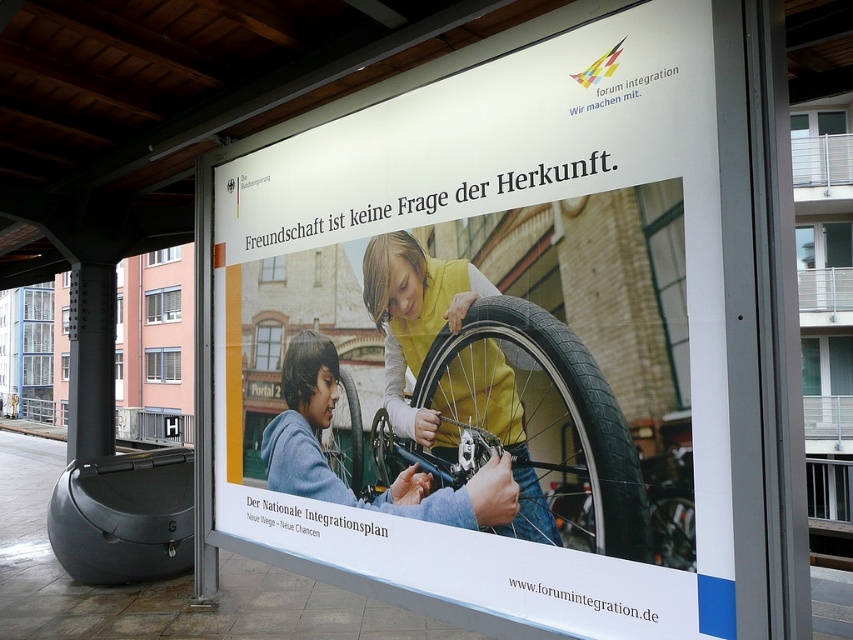
You are standing on the train station platform and want to take a photo of the white paper poster at center. The platform has a tiled floor and metal frames around. Where should you position yourself to ensure the poster is centered in your camera viewfinder?

The white paper poster at center is located at point coordinates (492, 332). To center it in your camera viewfinder, position yourself directly in front of the poster, aligning your camera with its central coordinates.

You are standing on the train station platform and see two points marked on the advertisement. The first point is at coordinates point (572, 212) and the second is at point (357, 396). Which point is closer to your eyes?

Point (572, 212) is closer to the camera than point (357, 396), so the first point is closer to your eyes.